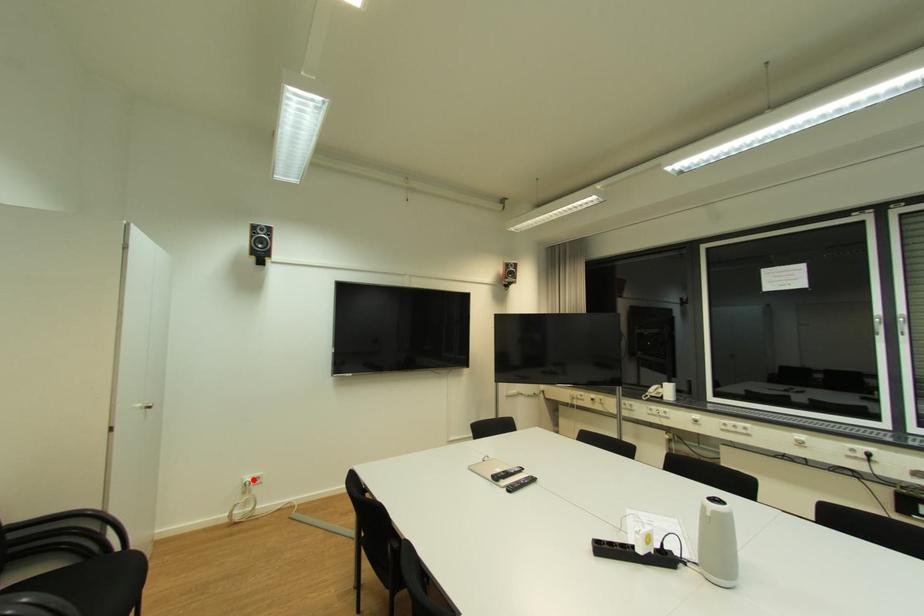
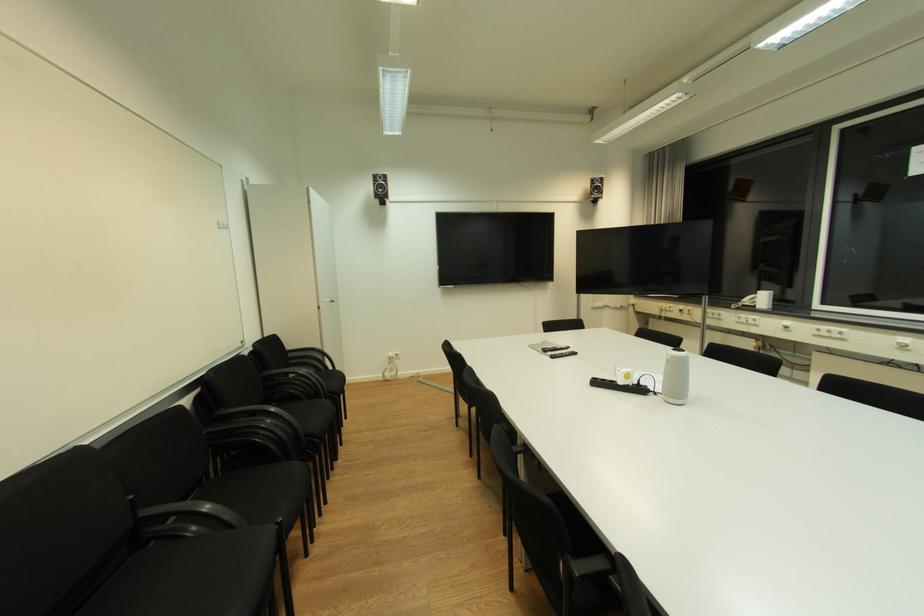
Question: A red point is marked in image1. In image2, is the corresponding 3D point closer to the camera or farther? Reply with the corresponding letter.

Choices:
 (A) The corresponding 3D point is closer.
 (B) The corresponding 3D point is farther.

Answer: (A)